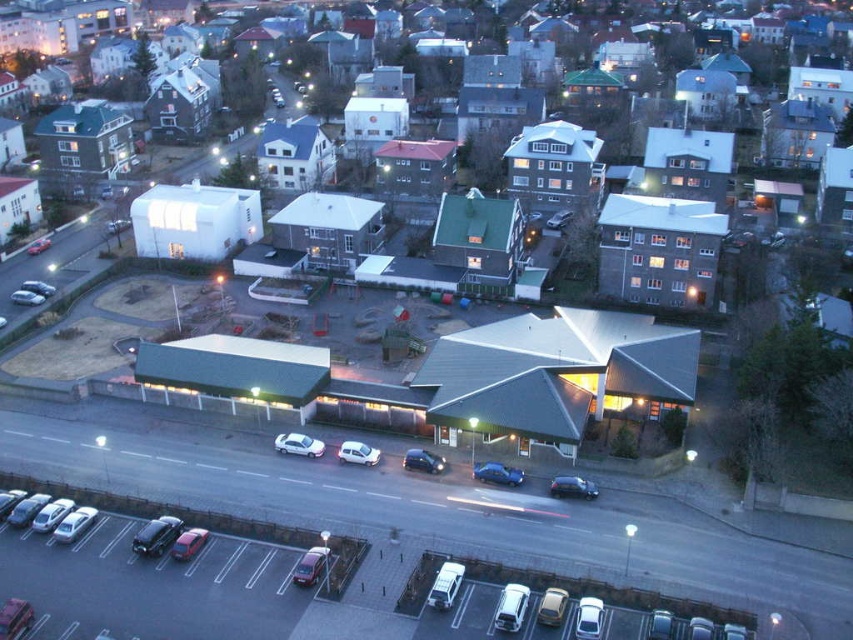
Question: Does silver metallic car at center have a smaller size compared to shiny silver car at center?

Choices:
 (A) yes
 (B) no

Answer: (A)

Question: Which point appears farthest from the camera in this image?

Choices:
 (A) (497, 515)
 (B) (567, 476)
 (C) (282, 451)

Answer: (C)

Question: Which object is the farthest from the shiny silver car at center?

Choices:
 (A) metallic silver cars at lower left
 (B) shiny black car at center
 (C) white matte car at center

Answer: (A)

Question: Which of the following is the farthest from the observer?

Choices:
 (A) silver metallic car at center
 (B) shiny blue sedan at center
 (C) metallic silver cars at lower left
 (D) shiny silver car at center

Answer: (A)

Question: Can you confirm if metallic silver cars at lower left is smaller than silver metallic car at center?

Choices:
 (A) yes
 (B) no

Answer: (B)

Question: Can you confirm if metallic silver cars at lower left is positioned to the left of white matte car at center?

Choices:
 (A) no
 (B) yes

Answer: (B)